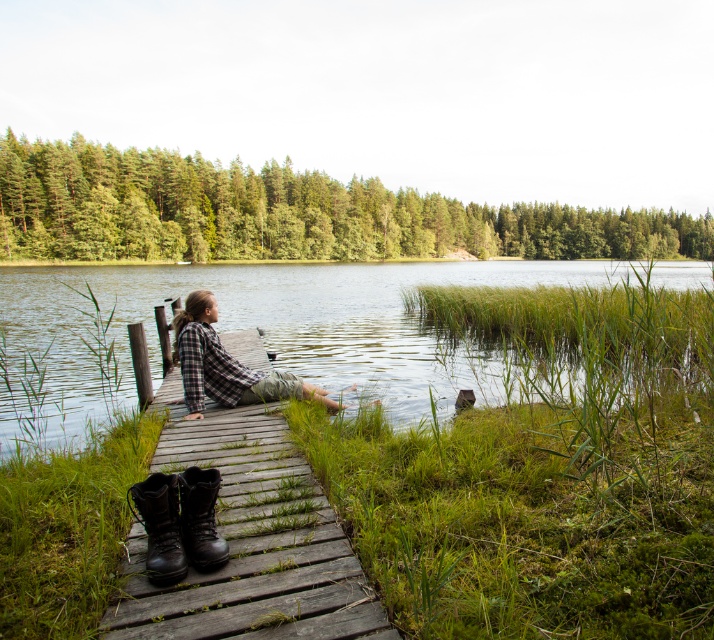
You are organizing a charity clothing drive and need to determine which items are suitable for donation. According to the scene, which item is more likely to be donated due to its size being appropriate for standard donation bins? Please choose between the plaid flannel shirt at center and the plaid fabric shirt at center.

The plaid fabric shirt at center is more likely to be donated because it is smaller in size compared to the plaid flannel shirt at center, making it better suited for standard donation bins.

Looking at this image, you are standing on the wooden dock at center and want to place a small potted plant on the plaid flannel shirt at center. Will the plant be visible above the dock?

The wooden dock at center has a lesser height compared to plaid flannel shirt at center, so the plant placed on the plaid flannel shirt at center will be visible above the dock.